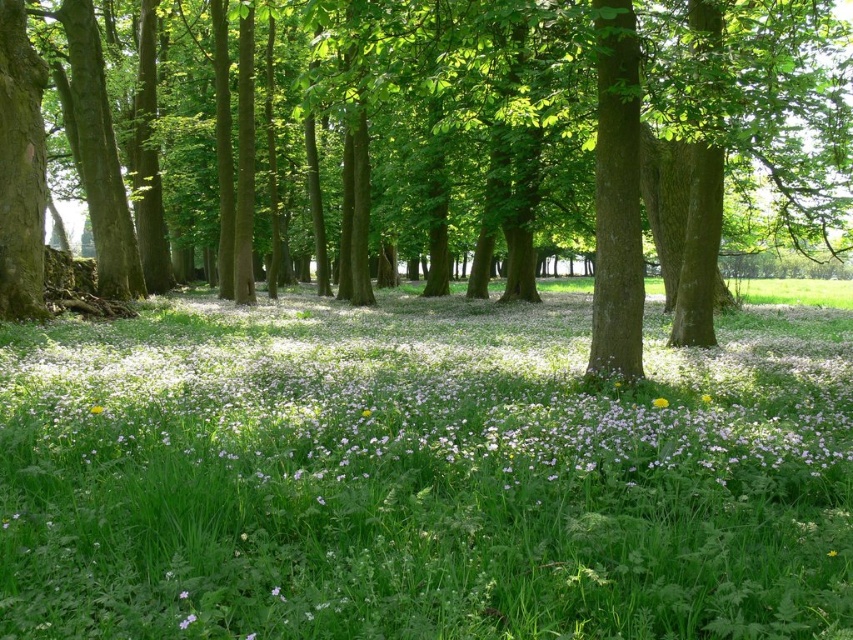
You are a bird flying over the forest and want to land on the nearest object. Which object would you land on first between the green leafy tree at center and the white matte flowers at center?

The green leafy tree at center is above the white matte flowers at center, so the bird would land on the green leafy tree at center first as it is closer to the bird while flying over.

You are a hiker standing at the edge of the forest. You see the green leafy tree at center and the white matte flowers at center. Which object is closer to you?

The green leafy tree at center is closer to you because the white matte flowers at center are positioned behind it.

You are standing at the entrance of the forest and see the white matte flowers at center. If you walk straight ahead, will you reach the flowers before the dense array of tall trees with slender trunks?

The white matte flowers at center are located at point (x=416, y=410), which is closer to the entrance than the dense array of tall trees with slender trunks in the midground. Therefore, you will reach the white matte flowers at center before the trees.